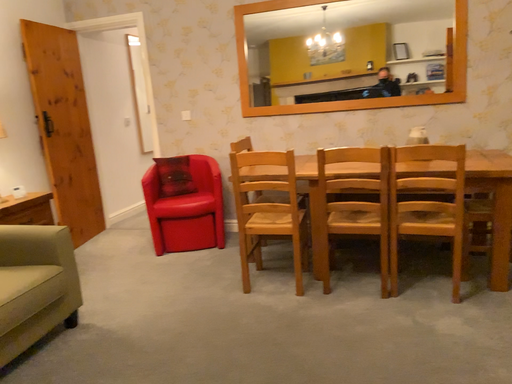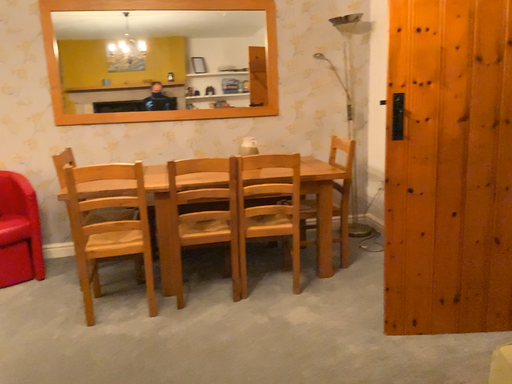
Question: Which way did the camera rotate in the video?

Choices:
 (A) rotated right
 (B) rotated left

Answer: (A)